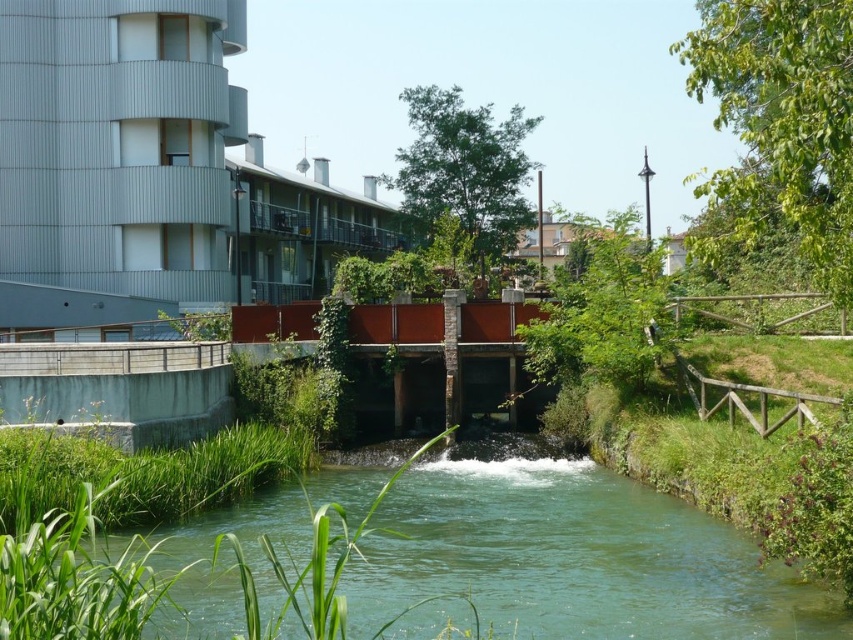
You are standing at the origin point of the image. Where is the green translucent water at center located?

The green translucent water at center is located at point (573, 557).

Looking at this image, you are a city planner analyzing the image. You need to determine if the green translucent water at center can accommodate a new boat that requires a minimum width of 15 meters. Given the metallic gray building at upper left is 20 meters wide, what is your assessment?

The green translucent water at center has a width less than the metallic gray building at upper left, which is 20 meters wide. Since the water is narrower than the building, it is likely less than 15 meters wide, so the boat requiring 15 meters cannot be accommodated.